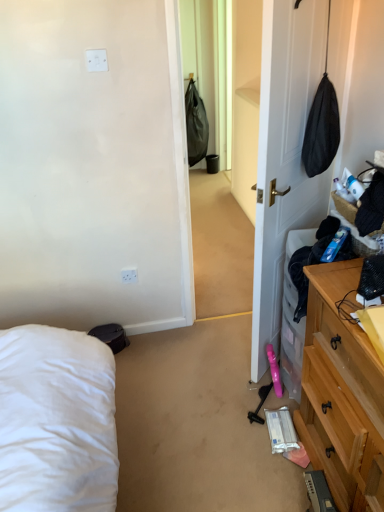
This screenshot has width=384, height=512. Identify the location of light wood dresser at right. (341, 391).

Considering the relative sizes of white plastic electric outlet at upper center and light wood dresser at right in the image provided, is white plastic electric outlet at upper center wider than light wood dresser at right?

In fact, white plastic electric outlet at upper center might be narrower than light wood dresser at right.

Considering the points (133, 279) and (341, 398), which point is behind, point (133, 279) or point (341, 398)?

The point (133, 279) is more distant.

Is white plastic electric outlet at upper center to the right of light wood dresser at right from the viewer's perspective?

No, white plastic electric outlet at upper center is not to the right of light wood dresser at right.

Could you tell me if white plastic electric outlet at upper center is turned towards light wood dresser at right?

No, white plastic electric outlet at upper center does not turn towards light wood dresser at right.

Where is `electric outlet that is below the white matte door at center (from the image's perspective)`? Image resolution: width=384 pixels, height=512 pixels. electric outlet that is below the white matte door at center (from the image's perspective) is located at coordinates (129, 275).

Can you confirm if white matte door at center is thinner than white plastic electric outlet at upper center?

No, white matte door at center is not thinner than white plastic electric outlet at upper center.

Is white matte door at center not near white plastic electric outlet at upper center?

white matte door at center is far away from white plastic electric outlet at upper center.

Is white plastic electric outlet at upper center next to white matte door at center and touching it?

No, white plastic electric outlet at upper center is not with white matte door at center.

Is white plastic electric outlet at upper center taller than white matte door at center?

No.

You are a GUI agent. You are given a task and a screenshot of the screen. Output one action in this format:
    pyautogui.click(x=<x>, y=<y>)
    Task: Click on the electric outlet located underneath the white matte door at center (from a real-world perspective)
    The height and width of the screenshot is (512, 384).
    Given the screenshot: What is the action you would take?
    [x=129, y=275]

Considering the sizes of objects light wood dresser at right and white plastic electric outlet at upper center in the image provided, who is smaller, light wood dresser at right or white plastic electric outlet at upper center?

white plastic electric outlet at upper center.

Find the location of a particular element. This screenshot has width=384, height=512. cabinetry below the white plastic electric outlet at upper center (from the image's perspective) is located at coordinates (341, 391).

Is light wood dresser at right positioned far away from white plastic electric outlet at upper center?

Absolutely, light wood dresser at right is distant from white plastic electric outlet at upper center.

Which is correct: light wood dresser at right is inside white plastic electric outlet at upper center, or outside of it?

light wood dresser at right is outside white plastic electric outlet at upper center.

Which object is positioned more to the left, white matte door at center or light wood dresser at right?

Positioned to the left is white matte door at center.

Looking at this image, are white matte door at center and light wood dresser at right making contact?

No, white matte door at center is not with light wood dresser at right.

From a real-world perspective, which is physically above, white matte door at center or light wood dresser at right?

From a 3D spatial view, white matte door at center is above.

Considering the sizes of objects white matte door at center and light wood dresser at right in the image provided, who is taller, white matte door at center or light wood dresser at right?

Standing taller between the two is white matte door at center.

Is light wood dresser at right shorter than white matte door at center?

Yes, light wood dresser at right is shorter than white matte door at center.

Which object is thinner, light wood dresser at right or white matte door at center?

white matte door at center is thinner.

From the image's perspective, is light wood dresser at right above or below white matte door at center?

From the image's perspective, light wood dresser at right appears below white matte door at center.

Where is `cabinetry that is above the white plastic electric outlet at upper center (from a real-world perspective)`? The height and width of the screenshot is (512, 384). cabinetry that is above the white plastic electric outlet at upper center (from a real-world perspective) is located at coordinates (341, 391).

The image size is (384, 512). Find the location of `door to the right of white plastic electric outlet at upper center`. door to the right of white plastic electric outlet at upper center is located at coordinates (284, 155).

Based on the photo, which object lies further to the anchor point white plastic electric outlet at upper center, white matte door at center or light wood dresser at right?

light wood dresser at right lies further to white plastic electric outlet at upper center than the other object.

Which object lies nearer to the anchor point white matte door at center, white plastic electric outlet at upper center or light wood dresser at right?

The object closer to white matte door at center is light wood dresser at right.

Based on the photo, based on their spatial positions, is white matte door at center or white plastic electric outlet at upper center closer to light wood dresser at right?

white matte door at center.

Which object lies further to the anchor point light wood dresser at right, white plastic electric outlet at upper center or white matte door at center?

white plastic electric outlet at upper center lies further to light wood dresser at right than the other object.

Estimate the real-world distances between objects in this image. Which object is further from white plastic electric outlet at upper center, light wood dresser at right or white matte door at center?

light wood dresser at right is further to white plastic electric outlet at upper center.

Estimate the real-world distances between objects in this image. Which object is closer to white matte door at center, light wood dresser at right or white plastic electric outlet at upper center?

Among the two, light wood dresser at right is located nearer to white matte door at center.

Locate an element on the screen. This screenshot has height=512, width=384. door located between light wood dresser at right and white plastic electric outlet at upper center in the depth direction is located at coordinates (284, 155).